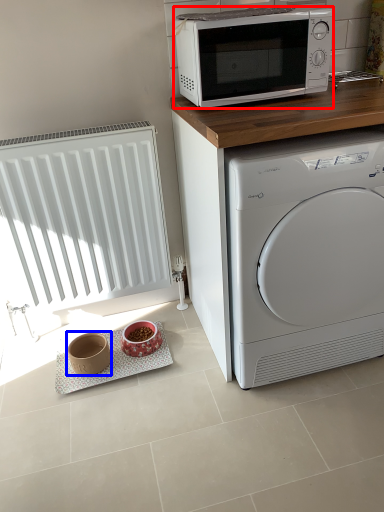
Question: Which point is closer to the camera, microwave oven (highlighted by a red box) or appliance (highlighted by a blue box)?

Choices:
 (A) microwave oven
 (B) appliance

Answer: (A)